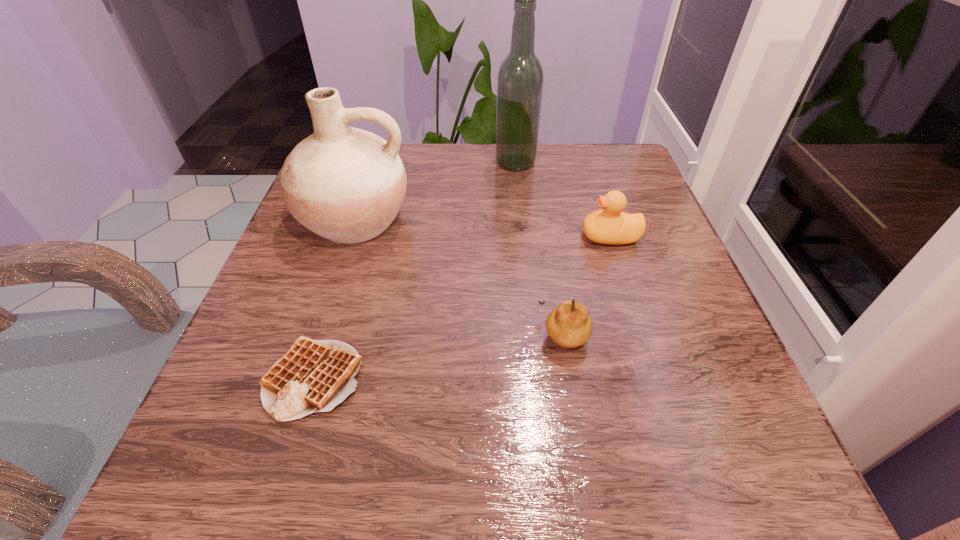
Identify the location of free space that is in between the rightmost object and the shortest object. (462, 307).

At what (x,y) coordinates should I click in order to perform the action: click on free point between the pottery and the pear. Please return your answer as a coordinate pair (x, y). The image size is (960, 540). Looking at the image, I should click on (459, 276).

At what (x,y) coordinates should I click in order to perform the action: click on vacant area between the shortest object and the liquor. Please return your answer as a coordinate pair (x, y). This screenshot has width=960, height=540. Looking at the image, I should click on (415, 271).

Image resolution: width=960 pixels, height=540 pixels. I want to click on free area in between the shortest object and the liquor, so click(415, 271).

In order to click on vacant space that is in between the liquor and the pear in this screenshot , I will do `click(540, 248)`.

You are a GUI agent. You are given a task and a screenshot of the screen. Output one action in this format:
    pyautogui.click(x=<x>, y=<y>)
    Task: Click on the object that stands as the closest to the shortest object
    The image size is (960, 540).
    Given the screenshot: What is the action you would take?
    (345, 184)

Select which object is the fourth closest to the liquor. Please provide its 2D coordinates. Your answer should be formatted as a tuple, i.e. [(x, y)], where the tuple contains the x and y coordinates of a point satisfying the conditions above.

[(313, 376)]

The width and height of the screenshot is (960, 540). In order to click on vacant space that satisfies the following two spatial constraints: 1. to pour from the handle of the shortest object; 2. on the left side of the pottery in this screenshot , I will do `click(302, 379)`.

The height and width of the screenshot is (540, 960). I want to click on free spot that satisfies the following two spatial constraints: 1. on the front side of the pear; 2. on the right side of the farthest object, so (x=534, y=334).

What are the coordinates of `vacant space that satisfies the following two spatial constraints: 1. on the face of the duck; 2. on the front side of the pear` in the screenshot? It's located at (642, 334).